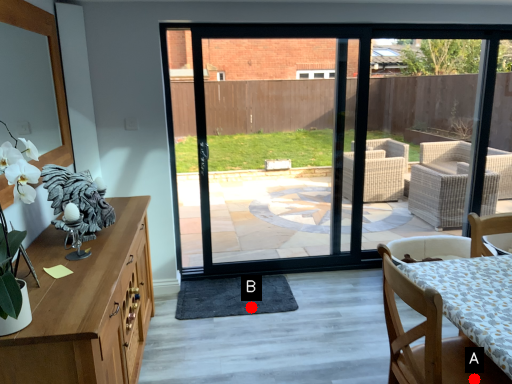
Question: Two points are circled on the image, labeled by A and B beside each circle. Which point is closer to the camera taking this photo?

Choices:
 (A) A is closer
 (B) B is closer

Answer: (A)